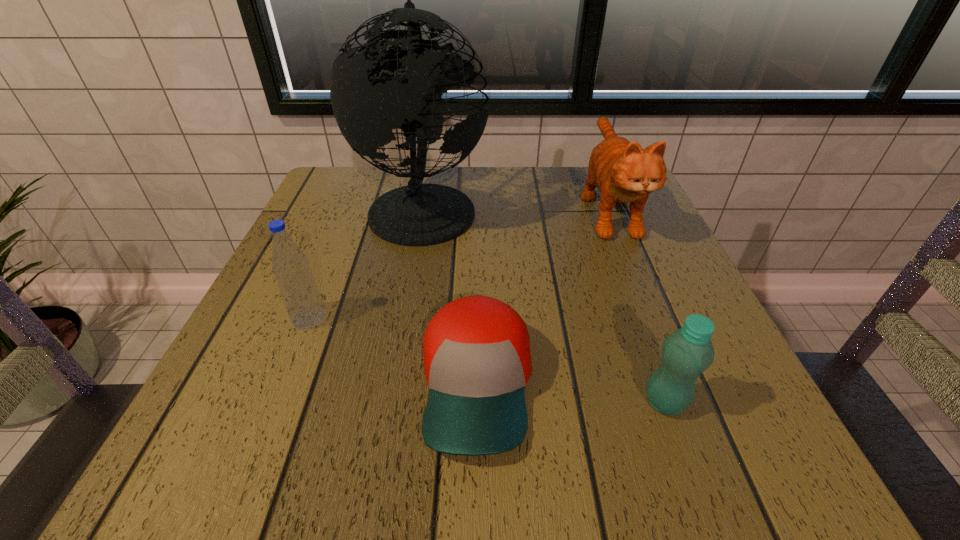
Identify the location of vacant region located at the front cap of the second shortest object. (433, 402).

Where is `free space located 0.070m at the front cap of the second shortest object`? The height and width of the screenshot is (540, 960). free space located 0.070m at the front cap of the second shortest object is located at coordinates (594, 402).

You are a GUI agent. You are given a task and a screenshot of the screen. Output one action in this format:
    pyautogui.click(x=<x>, y=<y>)
    Task: Click on the vacant space located at the front cap of the second shortest object
    This screenshot has height=540, width=960.
    Given the screenshot: What is the action you would take?
    pyautogui.click(x=433, y=402)

At what (x,y) coordinates should I click in order to perform the action: click on globe positioned at the far edge. Please return your answer as a coordinate pair (x, y). This screenshot has height=540, width=960. Looking at the image, I should click on (417, 214).

The width and height of the screenshot is (960, 540). I want to click on cat present at the far edge, so click(623, 172).

Image resolution: width=960 pixels, height=540 pixels. In order to click on water bottle situated at the near edge in this screenshot , I will do `click(685, 354)`.

At what (x,y) coordinates should I click in order to perform the action: click on baseball cap present at the near edge. Please return your answer as a coordinate pair (x, y). Looking at the image, I should click on 477,361.

Locate an element on the screen. This screenshot has height=540, width=960. globe located in the left edge section of the desktop is located at coordinates (417, 214).

Identify the location of water bottle located at the left edge. Image resolution: width=960 pixels, height=540 pixels. (297, 285).

Locate an element on the screen. This screenshot has height=540, width=960. cat that is at the right edge is located at coordinates (623, 172).